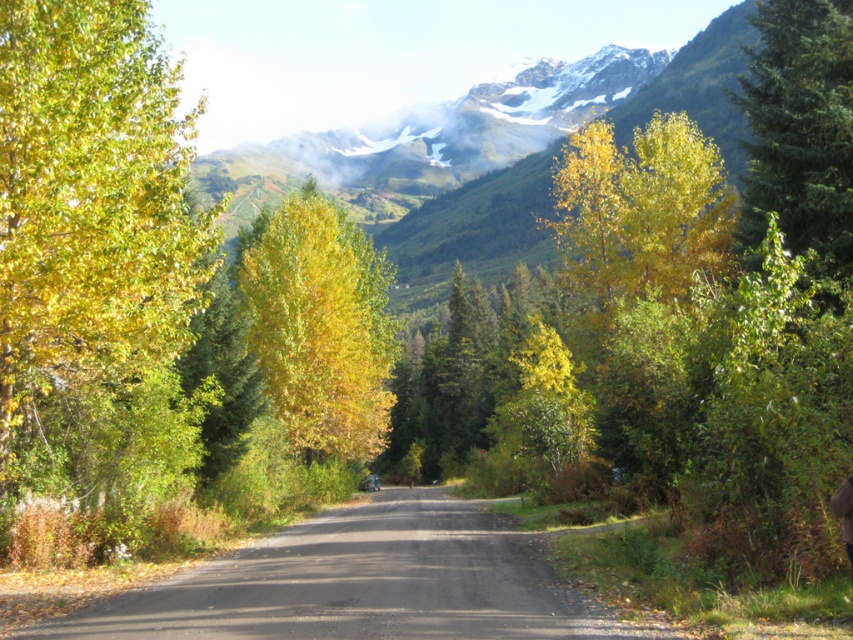
Is point (363, 381) positioned after point (851, 541)?

Yes, point (363, 381) is behind point (851, 541).

The width and height of the screenshot is (853, 640). What do you see at coordinates (318, 324) in the screenshot?
I see `yellow matte tree at center` at bounding box center [318, 324].

Which is in front, point (317, 205) or point (839, 492)?

Positioned in front is point (839, 492).

This screenshot has width=853, height=640. What are the coordinates of `yellow matte tree at center` in the screenshot? It's located at (318, 324).

Who is positioned more to the left, asphalt road at center or yellow matte tree at center?

yellow matte tree at center is more to the left.

Who is more distant from viewer, (403, 580) or (320, 417)?

Point (320, 417)

Between point (410, 554) and point (381, 326), which one is positioned behind?

Positioned behind is point (381, 326).

The image size is (853, 640). Identify the location of asphalt road at center. (364, 582).

Looking at this image, can you confirm if yellow-green leaves at left is thinner than green evergreen tree at right?

Yes.

Does point (149, 269) come behind point (766, 49)?

No, (149, 269) is closer to viewer.

Identify the location of yellow-green leaves at left. This screenshot has height=640, width=853. (94, 266).